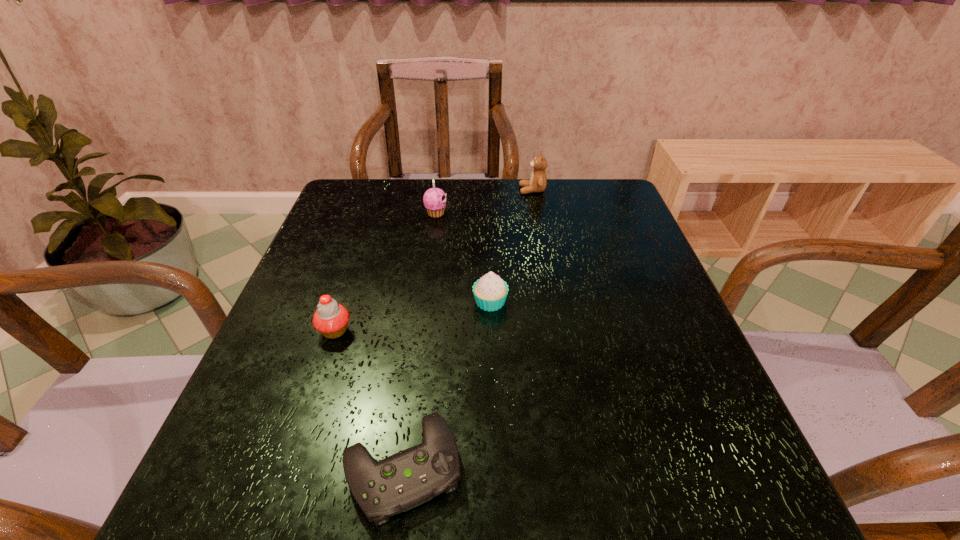
You are a GUI agent. You are given a task and a screenshot of the screen. Output one action in this format:
    pyautogui.click(x=<x>, y=<y>)
    Task: Click on the object present at the left edge
    The height and width of the screenshot is (540, 960).
    Given the screenshot: What is the action you would take?
    pyautogui.click(x=331, y=319)

In the image, there is a desktop. At what (x,y) coordinates should I click in order to perform the action: click on vacant region at the far edge. Please return your answer as a coordinate pair (x, y). This screenshot has width=960, height=540. Looking at the image, I should click on (553, 187).

Locate an element on the screen. free space at the near edge of the desktop is located at coordinates (559, 471).

In the image, there is a desktop. Identify the location of vacant space at the left edge. (382, 225).

The image size is (960, 540). I want to click on free space at the right edge of the desktop, so click(658, 398).

Locate an element on the screen. The height and width of the screenshot is (540, 960). free space at the far left corner of the desktop is located at coordinates (384, 186).

Identify the location of free spot at the far right corner of the desktop. [x=615, y=207].

Identify the location of free spot at the near right corner of the desktop. (730, 498).

The width and height of the screenshot is (960, 540). I want to click on empty location between the leftmost object and the rightmost object, so click(434, 260).

Locate an element on the screen. This screenshot has width=960, height=540. empty space between the teddy bear and the nearest object is located at coordinates (468, 329).